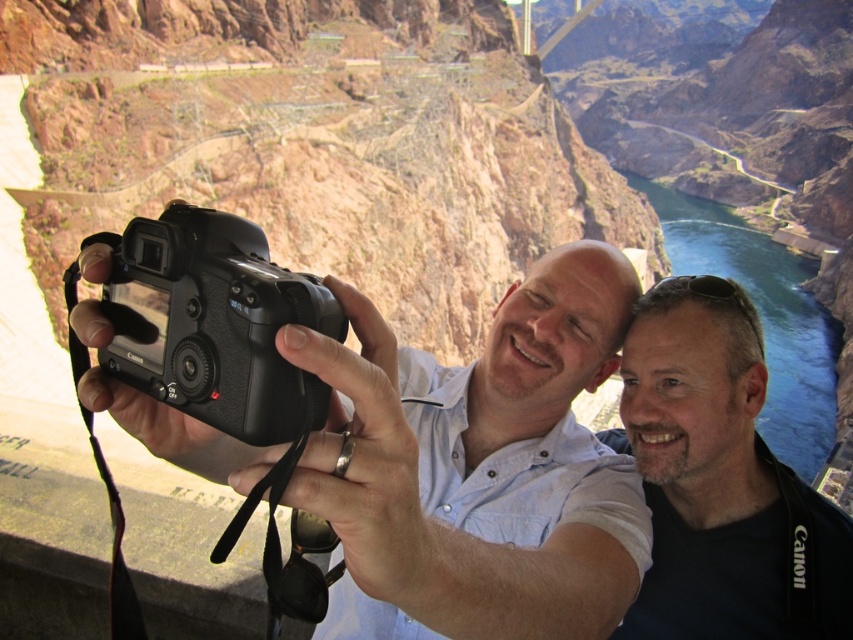
Question: Which point appears closest to the camera in this image?

Choices:
 (A) (691, 404)
 (B) (532, 460)

Answer: (A)

Question: Which point is farther to the camera?

Choices:
 (A) black plastic camera at center
 (B) black matte camera at center
 (C) dark blue t-shirt at center

Answer: (C)

Question: Observing the image, what is the correct spatial positioning of black matte camera at center in reference to black plastic camera at center?

Choices:
 (A) left
 (B) right

Answer: (B)

Question: Which object is the farthest from the black plastic camera at center?

Choices:
 (A) dark blue t-shirt at center
 (B) black matte camera at center

Answer: (A)

Question: Does black matte camera at center have a larger size compared to dark blue t-shirt at center?

Choices:
 (A) yes
 (B) no

Answer: (A)

Question: Can you confirm if black matte camera at center is thinner than black plastic camera at center?

Choices:
 (A) yes
 (B) no

Answer: (B)